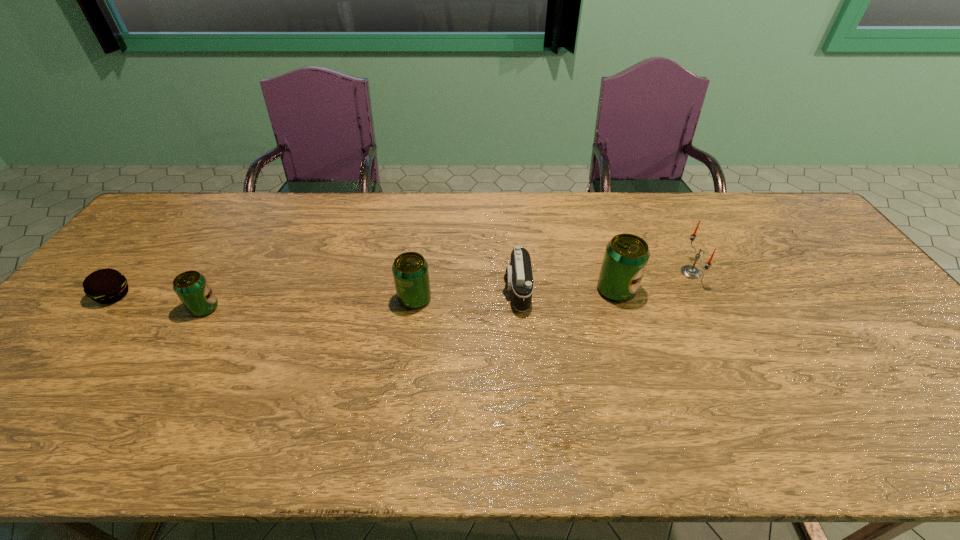
Locate an element on the screen. Image resolution: width=960 pixels, height=540 pixels. unoccupied position between the patty and the rightmost beer can is located at coordinates (365, 293).

Where is `unoccupied position between the tallest beer can and the candle`? The height and width of the screenshot is (540, 960). unoccupied position between the tallest beer can and the candle is located at coordinates click(x=654, y=281).

Identify the location of vacant area that lies between the leftmost object and the fifth object from left to right. (365, 293).

Locate an element on the screen. The width and height of the screenshot is (960, 540). vacant space that's between the fifth object from right to left and the patty is located at coordinates (159, 302).

Where is `free spot between the rightmost beer can and the camera`? free spot between the rightmost beer can and the camera is located at coordinates (566, 291).

Locate which object ranks third in proximity to the third object from right to left. Please provide its 2D coordinates. Your answer should be formatted as a tuple, i.e. [(x, y)], where the tuple contains the x and y coordinates of a point satisfying the conditions above.

[(689, 271)]

Select which object appears as the second closest to the rightmost object. Please provide its 2D coordinates. Your answer should be formatted as a tuple, i.e. [(x, y)], where the tuple contains the x and y coordinates of a point satisfying the conditions above.

[(518, 278)]

The height and width of the screenshot is (540, 960). Identify the location of the second closest beer can to the second object from right to left. (191, 287).

Identify which beer can is the second closest to the leftmost beer can. Please provide its 2D coordinates. Your answer should be formatted as a tuple, i.e. [(x, y)], where the tuple contains the x and y coordinates of a point satisfying the conditions above.

[(626, 256)]

The image size is (960, 540). Identify the location of vacant region that satisfies the following two spatial constraints: 1. on the front lens of the camera; 2. on the front side of the third object from left to right. (517, 299).